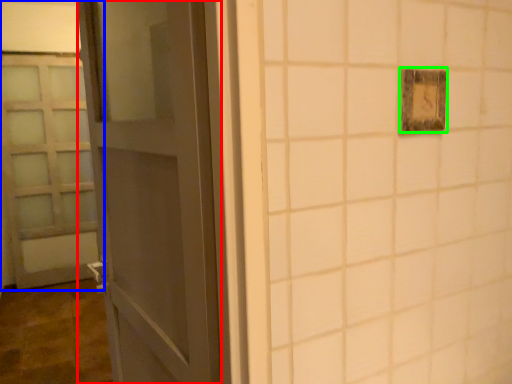
Question: Considering the real-world distances, which object is farthest from door (highlighted by a red box)? door (highlighted by a blue box) or light switch (highlighted by a green box)?

Choices:
 (A) door
 (B) light switch

Answer: (A)